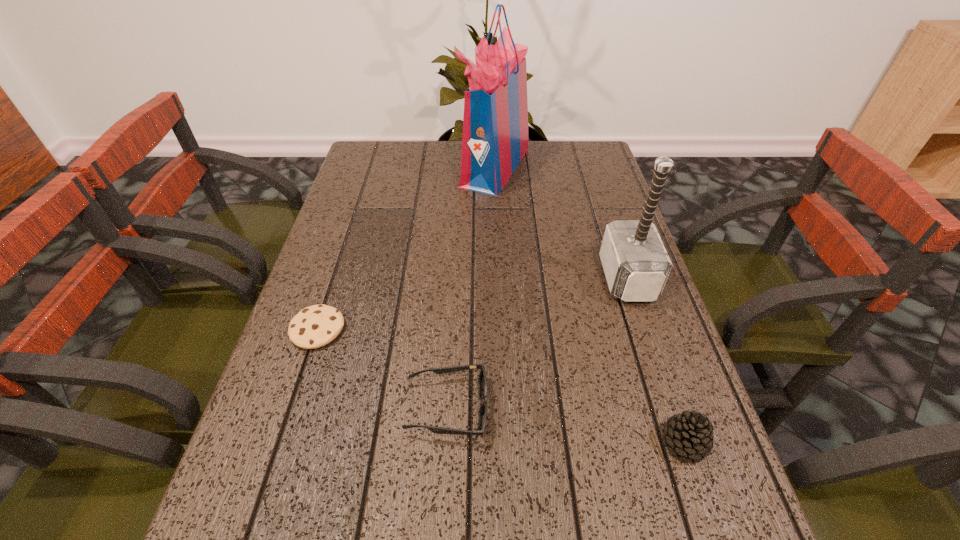
The height and width of the screenshot is (540, 960). Identify the location of object located in the left edge section of the desktop. (313, 327).

Where is `hammer that is positioned at the right edge`? The image size is (960, 540). hammer that is positioned at the right edge is located at coordinates (636, 264).

Find the location of `pinecone that is at the right edge`. pinecone that is at the right edge is located at coordinates (690, 435).

Where is `vacant space at the far edge of the desktop`? The width and height of the screenshot is (960, 540). vacant space at the far edge of the desktop is located at coordinates (527, 160).

At what (x,y) coordinates should I click in order to perform the action: click on free region at the left edge of the desktop. Please return your answer as a coordinate pair (x, y). This screenshot has width=960, height=540. Looking at the image, I should click on (326, 271).

Image resolution: width=960 pixels, height=540 pixels. Identify the location of vacant space at the right edge. (684, 390).

In the image, there is a desktop. Identify the location of vacant region at the far left corner. The height and width of the screenshot is (540, 960). (354, 176).

At what (x,y) coordinates should I click in order to perform the action: click on free location at the far right corner. Please return your answer as a coordinate pair (x, y). The width and height of the screenshot is (960, 540). Looking at the image, I should click on (578, 148).

This screenshot has height=540, width=960. Identify the location of free area in between the sunglasses and the grocery bag. 471,287.

Find the location of a particular element. free space between the hammer and the cookie is located at coordinates [x=472, y=303].